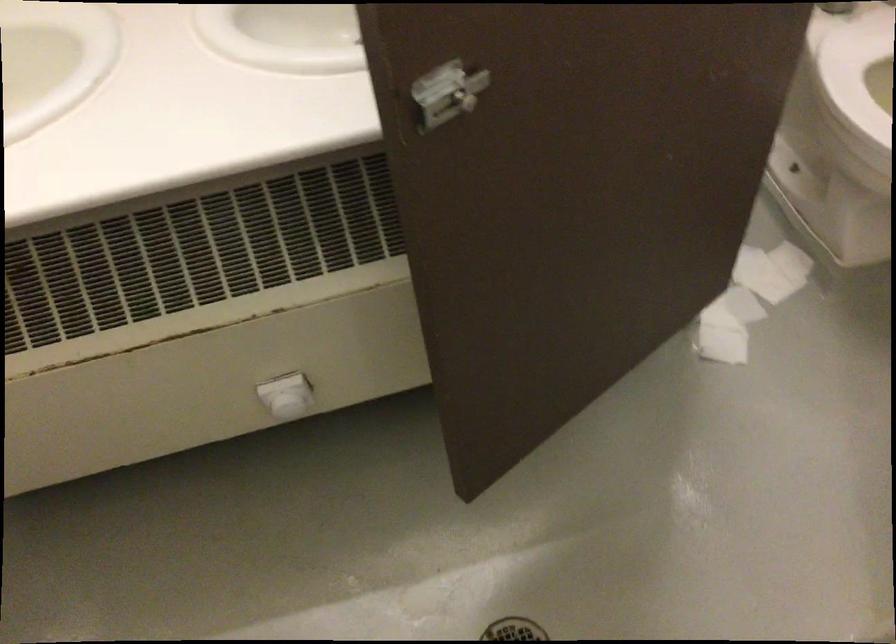
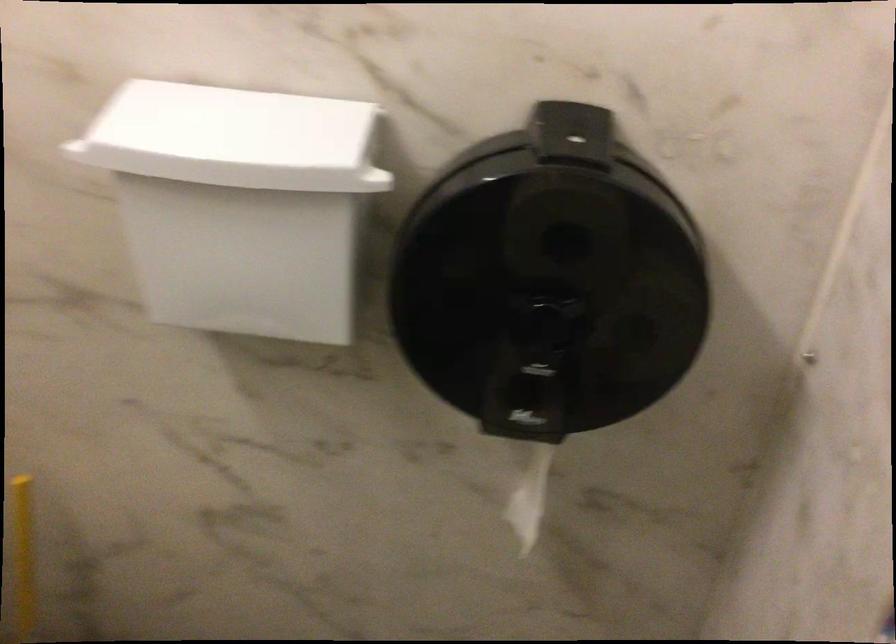
Question: The camera is either moving clockwise (left) or counter-clockwise (right) around the object. The first image is from the beginning of the video and the second image is from the end. Is the camera moving left or right when shooting the video?

Choices:
 (A) Left
 (B) Right

Answer: (A)